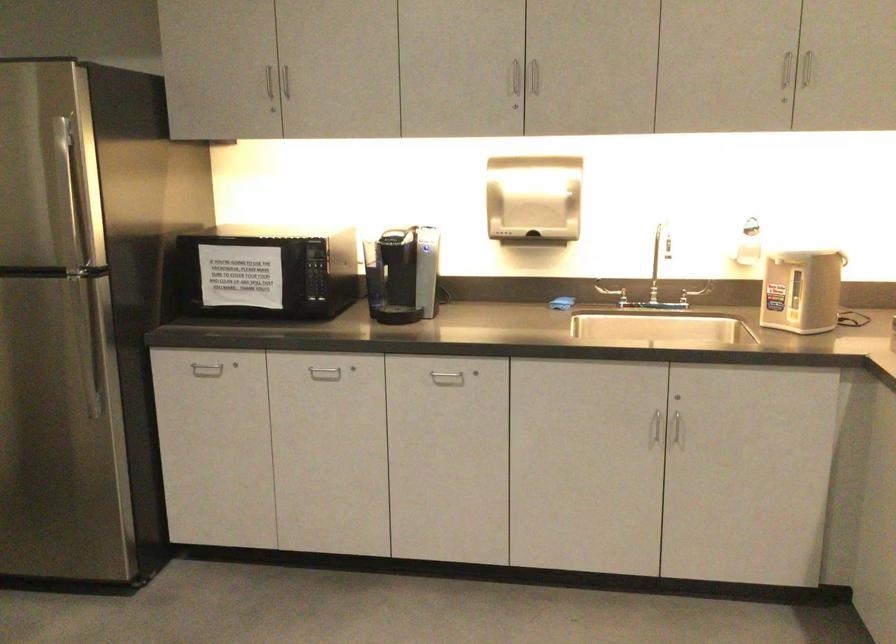
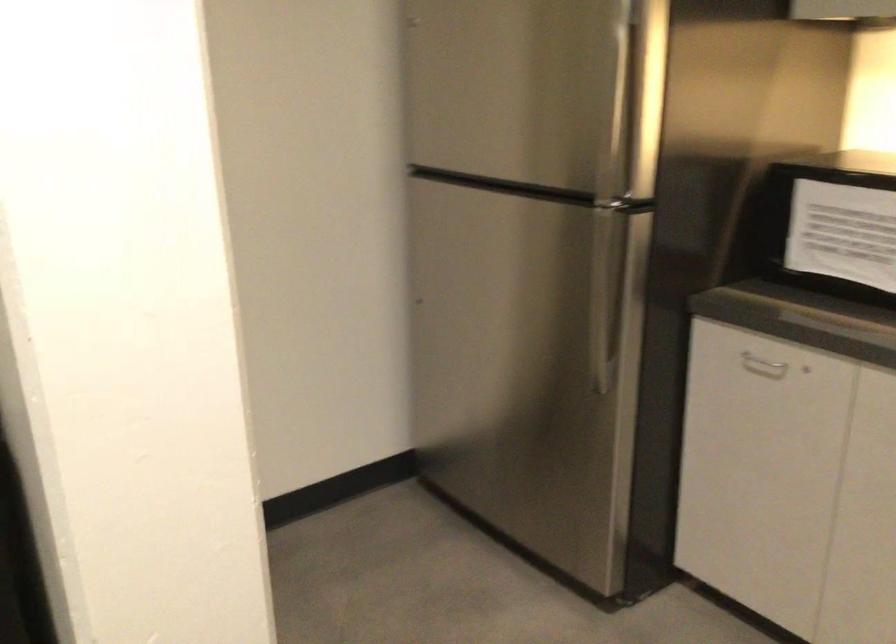
Question: The images are taken continuously from a first-person perspective. In which direction is your viewpoint rotating?

Choices:
 (A) Left
 (B) Right
 (C) Up
 (D) Down

Answer: (A)